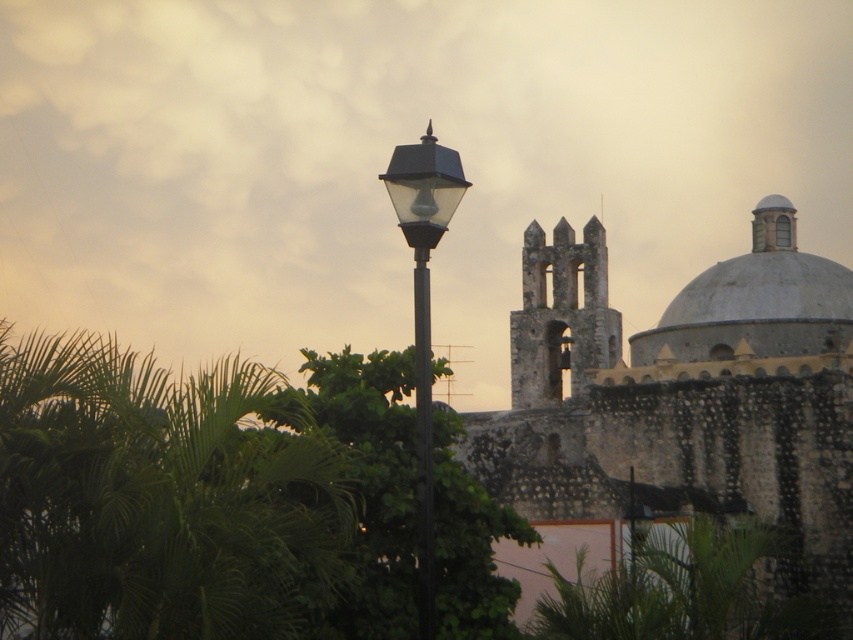
You are a tourist standing in front of the historic stone building. You notice the stone tower at center and the matte black street light at center. Which object is located to the right of the other?

The stone tower at center is positioned on the right side of the matte black street light at center.